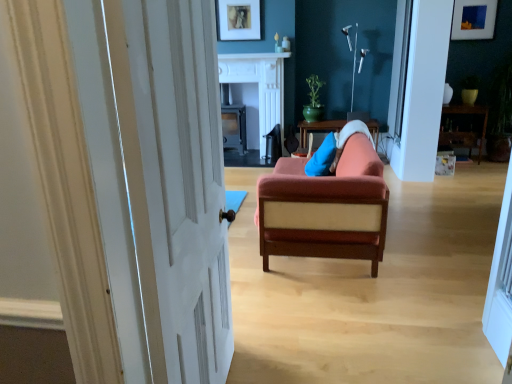
This screenshot has height=384, width=512. Find the location of `matte black fireplace at center, which is the 1th table in left-to-right order`. matte black fireplace at center, which is the 1th table in left-to-right order is located at coordinates (234, 127).

At what (x,y) coordinates should I click in order to perform the action: click on wooden table at right, which is the 2th table from left to right. Please return your answer as a coordinate pair (x, y). The height and width of the screenshot is (384, 512). Looking at the image, I should click on (470, 113).

Locate an element on the screen. matte black fireplace at center, which is the 1th table in left-to-right order is located at coordinates (234, 127).

Which point is more distant from viewer, (x=461, y=12) or (x=263, y=119)?

Positioned behind is point (x=263, y=119).

Which of these two, matte blue picture frame at upper right, the 2th picture frame when ordered from left to right, or white marble fireplace at center, is thinner?

Thinner between the two is matte blue picture frame at upper right, the 2th picture frame when ordered from left to right.

In terms of height, does matte blue picture frame at upper right, the 2th picture frame when ordered from left to right, look taller or shorter compared to white marble fireplace at center?

Clearly, matte blue picture frame at upper right, the 2th picture frame when ordered from left to right, is shorter compared to white marble fireplace at center.

Which object is closer to the camera, matte blue picture frame at upper right, the 2th picture frame when ordered from left to right, or white marble fireplace at center?

white marble fireplace at center.

Is white painted wood door at left surrounding white marble fireplace at upper center?

No, white marble fireplace at upper center is located outside of white painted wood door at left.

From the image's perspective, is white painted wood door at left above or below white marble fireplace at upper center?

Clearly, from the image's perspective, white painted wood door at left is below white marble fireplace at upper center.

Is white painted wood door at left to the right of white marble fireplace at upper center from the viewer's perspective?

Incorrect, white painted wood door at left is not on the right side of white marble fireplace at upper center.

Does white painted wood door at left turn towards white marble fireplace at upper center?

No, white painted wood door at left is not aimed at white marble fireplace at upper center.

Is white marble fireplace at center positioned with its back to matte blue picture frame at upper right, the 2th picture frame when ordered from left to right?

No, white marble fireplace at center is not facing the opposite direction of matte blue picture frame at upper right, the 2th picture frame when ordered from left to right.

Which is more to the right, white marble fireplace at center or matte blue picture frame at upper right, the 2th picture frame when ordered from left to right?

From the viewer's perspective, matte blue picture frame at upper right, the 2th picture frame when ordered from left to right, appears more on the right side.

Considering the relative sizes of white marble fireplace at center and matte blue picture frame at upper right, the 2th picture frame when ordered from left to right, in the image provided, is white marble fireplace at center bigger than matte blue picture frame at upper right, the 2th picture frame when ordered from left to right,?

Correct, white marble fireplace at center is larger in size than matte blue picture frame at upper right, the 2th picture frame when ordered from left to right.

Does point (240, 62) come farther from viewer compared to point (454, 34)?

Yes, point (240, 62) is behind point (454, 34).

Is blue fabric pillow at center to the left or to the right of white marble fireplace at upper center in the image?

Clearly, blue fabric pillow at center is on the right of white marble fireplace at upper center in the image.

Which object is more forward, blue fabric pillow at center or white marble fireplace at upper center?

blue fabric pillow at center is in front.

Could you tell me if blue fabric pillow at center is facing white marble fireplace at upper center?

No, blue fabric pillow at center does not turn towards white marble fireplace at upper center.

Considering the positions of objects velvet orange sofa at center and wooden table at right, the 1th table in the right-to-left sequence, in the image provided, who is in front, velvet orange sofa at center or wooden table at right, the 1th table in the right-to-left sequence,?

velvet orange sofa at center.

Which object is wider, velvet orange sofa at center or wooden table at right, the 1th table in the right-to-left sequence?

Wider between the two is velvet orange sofa at center.

How different are the orientations of velvet orange sofa at center and wooden table at right, the 1th table in the right-to-left sequence, in degrees?

There is a 89.8-degree angle between the facing directions of velvet orange sofa at center and wooden table at right, the 1th table in the right-to-left sequence.

Is velvet orange sofa at center facing away from wooden table at right, the 1th table in the right-to-left sequence?

velvet orange sofa at center is not turned away from wooden table at right, the 1th table in the right-to-left sequence.

Consider the image. Considering the sizes of objects velvet orange sofa at center and matte white picture frame at upper center, the 2th picture frame when ordered from right to left, in the image provided, who is taller, velvet orange sofa at center or matte white picture frame at upper center, the 2th picture frame when ordered from right to left,?

velvet orange sofa at center.

Considering the relative positions of velvet orange sofa at center and matte white picture frame at upper center, the 2th picture frame when ordered from right to left, in the image provided, is velvet orange sofa at center to the right of matte white picture frame at upper center, the 2th picture frame when ordered from right to left, from the viewer's perspective?

→ Yes.

From the image's perspective, which is below, velvet orange sofa at center or matte white picture frame at upper center, the 2th picture frame when ordered from right to left?

velvet orange sofa at center.

Is velvet orange sofa at center directly adjacent to matte white picture frame at upper center, the first picture frame when ordered from left to right?

No.

Is white marble fireplace at center located outside white painted wood door at left?

Yes.

Looking at this image, how different are the orientations of white marble fireplace at center and white painted wood door at left in degrees?

There is a 81-degree angle between the facing directions of white marble fireplace at center and white painted wood door at left.

Is point (263, 113) farther from camera compared to point (198, 35)?

Yes, point (263, 113) is farther from viewer.

Could you tell me if white marble fireplace at center is turned towards white painted wood door at left?

Yes, white marble fireplace at center is aimed at white painted wood door at left.

Locate an element on the screen. the 1st picture frame above the white marble fireplace at center (from a real-world perspective) is located at coordinates 473,19.

Where is `mantle behind the white painted wood door at left`? The height and width of the screenshot is (384, 512). mantle behind the white painted wood door at left is located at coordinates (254, 56).

Estimate the real-world distances between objects in this image. Which object is further from matte white picture frame at upper center, the 2th picture frame when ordered from right to left, wooden table at right, the 1th table in the right-to-left sequence, or green glossy pot at upper center?

wooden table at right, the 1th table in the right-to-left sequence, is positioned further to the anchor matte white picture frame at upper center, the 2th picture frame when ordered from right to left.

Based on their spatial positions, is matte black fireplace at center, which is the second table from right to left, or matte blue picture frame at upper right, which is the 1th picture frame from right to left, closer to velvet orange sofa at center?

matte black fireplace at center, which is the second table from right to left, is positioned closer to the anchor velvet orange sofa at center.

Looking at the image, which one is located further to green glossy pot at upper center, white marble fireplace at upper center or matte black fireplace at center, which is the 1th table in left-to-right order?

The object further to green glossy pot at upper center is matte black fireplace at center, which is the 1th table in left-to-right order.

Which object lies further to the anchor point blue fabric pillow at center, white painted wood door at left or velvet orange sofa at center?

white painted wood door at left is positioned further to the anchor blue fabric pillow at center.

Looking at the image, which one is located closer to matte black fireplace at center, which is the 1th table in left-to-right order, velvet orange sofa at center or white marble fireplace at upper center?

white marble fireplace at upper center is closer to matte black fireplace at center, which is the 1th table in left-to-right order.

When comparing their distances from white painted wood door at left, does matte black fireplace at center, which is the second table from right to left, or white marble fireplace at center seem closer?

white marble fireplace at center lies closer to white painted wood door at left than the other object.

In the scene shown: From the image, which object appears to be farther from blue fabric pillow at center, green glossy pot at upper center or wooden table at right, which is the 2th table from left to right?

wooden table at right, which is the 2th table from left to right.

From the image, which object appears to be nearer to green glossy pot at upper center, wooden table at right, which is the 2th table from left to right, or white marble fireplace at center?

Among the two, white marble fireplace at center is located nearer to green glossy pot at upper center.

I want to click on mantle between velvet orange sofa at center and matte white picture frame at upper center, the 2th picture frame when ordered from right to left, along the z-axis, so click(254, 56).

I want to click on chair positioned between white painted wood door at left and matte black fireplace at center, which is the 1th table in left-to-right order, from near to far, so click(x=326, y=208).

Find the location of a particular element. The width and height of the screenshot is (512, 384). fireplace located between velvet orange sofa at center and white marble fireplace at upper center in the depth direction is located at coordinates (258, 89).

Find the location of `fireplace between blue fabric pillow at center and green glossy pot at upper center in the front-back direction`. fireplace between blue fabric pillow at center and green glossy pot at upper center in the front-back direction is located at coordinates (258, 89).